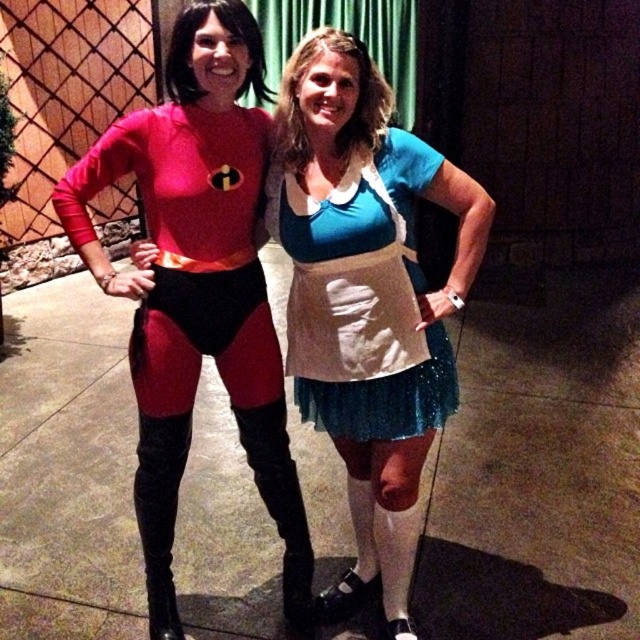
Question: Which of the following is the closest to the observer?

Choices:
 (A) (403, 332)
 (B) (248, 236)
 (C) (412, 397)

Answer: (A)

Question: Which of the following is the closest to the observer?

Choices:
 (A) (136, 497)
 (B) (348, 257)
 (C) (288, 205)

Answer: (B)

Question: Which object is farther from the camera taking this photo?

Choices:
 (A) shiny spandex suit at left
 (B) blue satin dress at center

Answer: (B)

Question: Observing the image, what is the correct spatial positioning of blue satin dress at center in reference to shiny spandex suit at left?

Choices:
 (A) right
 (B) left

Answer: (A)

Question: Is shiny spandex suit at left bigger than teal tulle dress at center?

Choices:
 (A) no
 (B) yes

Answer: (B)

Question: Is blue satin dress at center closer to the viewer compared to shiny spandex suit at left?

Choices:
 (A) no
 (B) yes

Answer: (A)